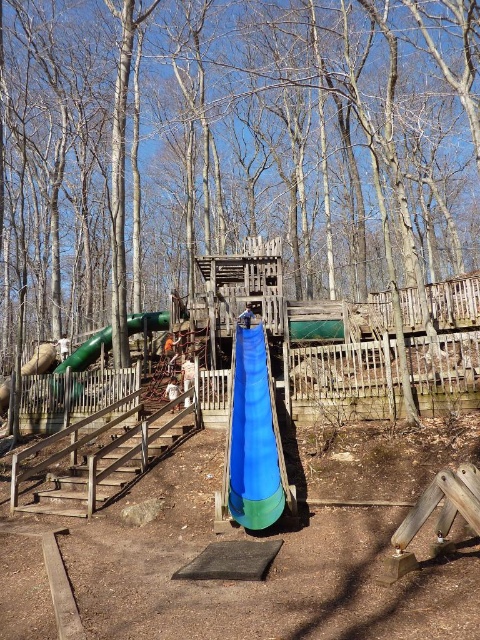
Question: Can you confirm if green wood tree at center is smaller than white fabric at center?

Choices:
 (A) no
 (B) yes

Answer: (A)

Question: Can you confirm if green wood tree at center is positioned below blue fabric slide at center?

Choices:
 (A) yes
 (B) no

Answer: (B)

Question: Which point appears farthest from the camera in this image?

Choices:
 (A) (202, 211)
 (B) (172, 388)
 (C) (235, 358)

Answer: (A)

Question: Which object is positioned farthest from the green wood tree at center?

Choices:
 (A) white fabric at center
 (B) blue fabric slide at center

Answer: (B)

Question: Estimate the real-world distances between objects in this image. Which object is farther from the blue fabric slide at center?

Choices:
 (A) green wood tree at center
 (B) white fabric at center

Answer: (A)

Question: Does green wood tree at center appear on the right side of blue fabric slide at center?

Choices:
 (A) no
 (B) yes

Answer: (A)